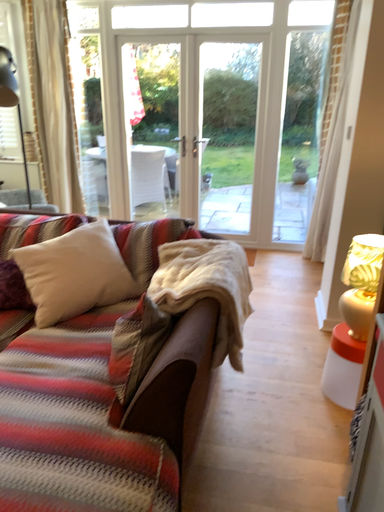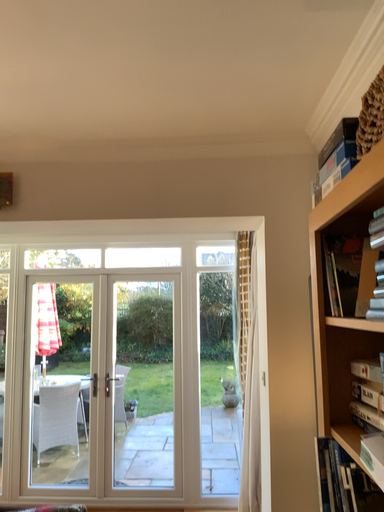
Question: Which way did the camera rotate in the video?

Choices:
 (A) rotated left
 (B) rotated right

Answer: (B)